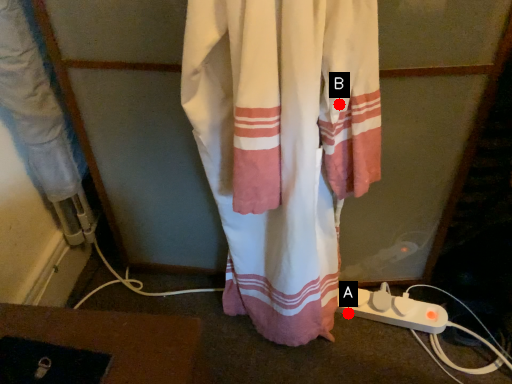
Question: Two points are circled on the image, labeled by A and B beside each circle. Which point appears farthest from the camera in this image?

Choices:
 (A) A is further
 (B) B is further

Answer: (A)